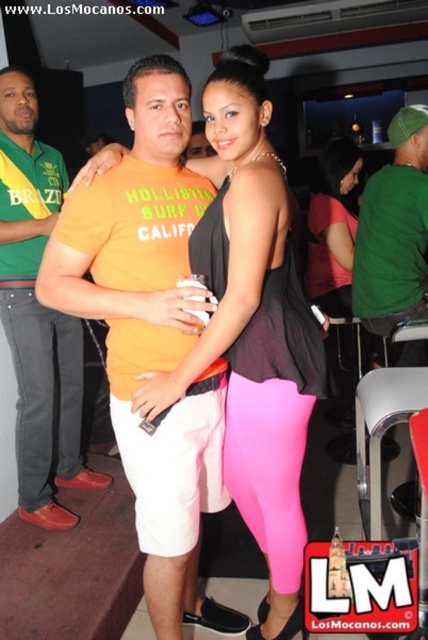
You are standing in the bar and want to take a photo of both the point at coordinates point (425, 115) and point (353, 234). Which point should you focus on first to ensure both are in focus?

Point (425, 115) is in front of point (353, 234), so you should focus on the closer point first to ensure both are in focus.

You are a photographer trying to capture a closeup of both the green matte shirt at right and the pink matte leggings at center. Given that your camera has a minimum focus distance of 18 inches, will you be able to focus on both subjects simultaneously?

The green matte shirt at right and the pink matte leggings at center are 18.76 inches apart, which is just over the camera minimum focus distance of 18 inches. Therefore, the photographer can focus on both subjects simultaneously.